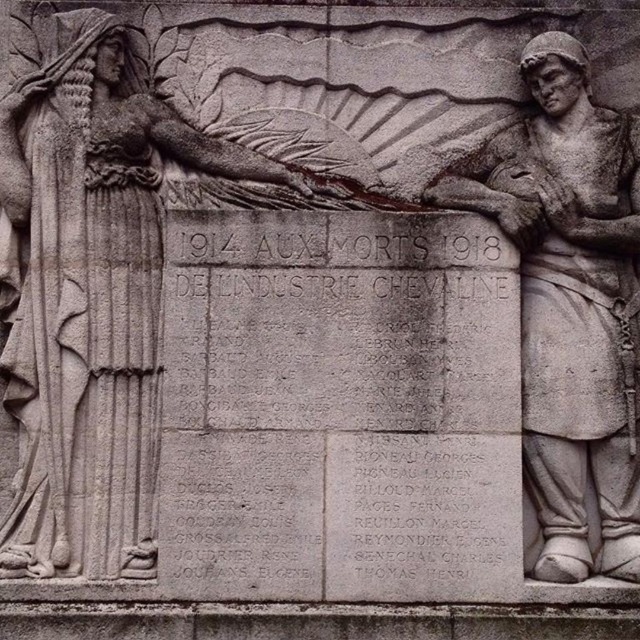
Does gray stone statue at left have a lesser width compared to gray stone soldier at right?

No, gray stone statue at left is not thinner than gray stone soldier at right.

Is gray stone statue at left positioned before gray stone soldier at right?

No, it is not.

Between point (77, 100) and point (564, 132), which one is positioned in front?

Positioned in front is point (77, 100).

The width and height of the screenshot is (640, 640). What are the coordinates of `gray stone statue at left` in the screenshot? It's located at (92, 296).